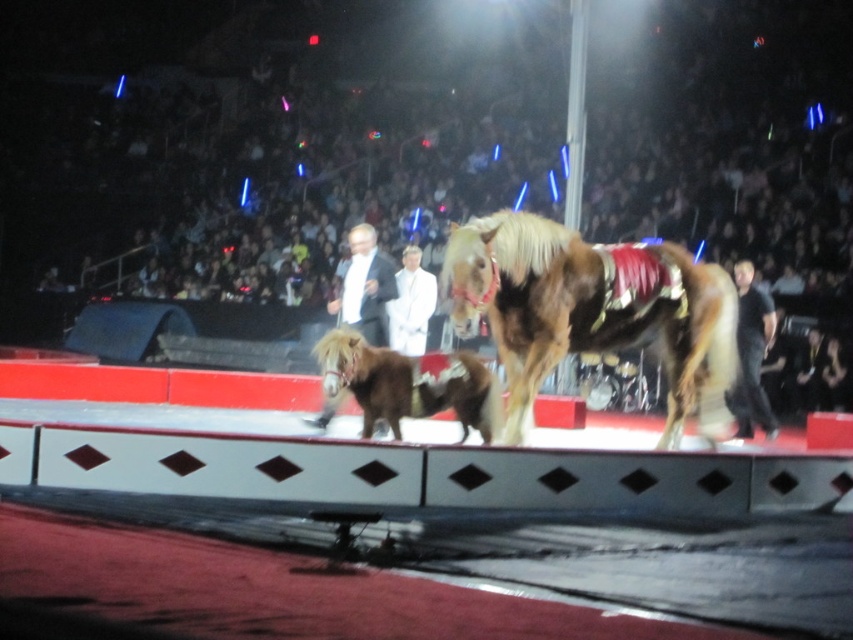
Where is `brown fuzzy horse at center`? brown fuzzy horse at center is located at coordinates (409, 384).

Is point (490, 401) less distant than point (740, 396)?

Yes, it is in front of point (740, 396).

In order to click on brown fuzzy horse at center in this screenshot , I will do `click(409, 384)`.

Between brown fuzzy horse at center and white satin suit at center, which one has more height?

white satin suit at center is taller.

Between point (479, 413) and point (352, 284), which one is positioned behind?

Positioned behind is point (352, 284).

What are the coordinates of `brown fuzzy horse at center` in the screenshot? It's located at (409, 384).

You are a GUI agent. You are given a task and a screenshot of the screen. Output one action in this format:
    pyautogui.click(x=<x>, y=<y>)
    Task: Click on the white satin suit at center
    This screenshot has height=640, width=853.
    Given the screenshot: What is the action you would take?
    pyautogui.click(x=364, y=285)

Who is more distant from viewer, (x=380, y=253) or (x=737, y=406)?

Point (x=737, y=406)

Is point (328, 406) farther from viewer compared to point (749, 326)?

No, (328, 406) is in front of (749, 326).

Locate an element on the screen. The image size is (853, 640). white satin suit at center is located at coordinates (364, 285).